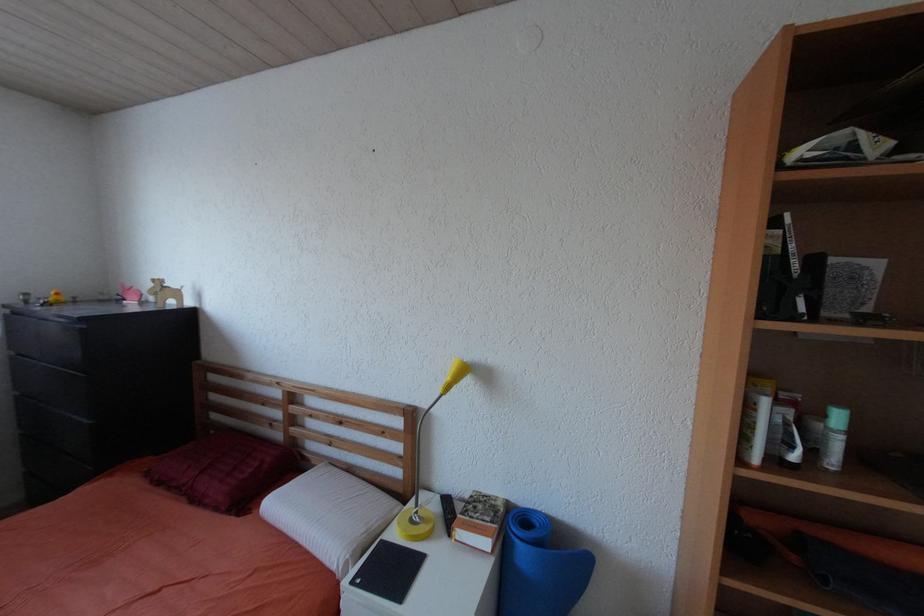
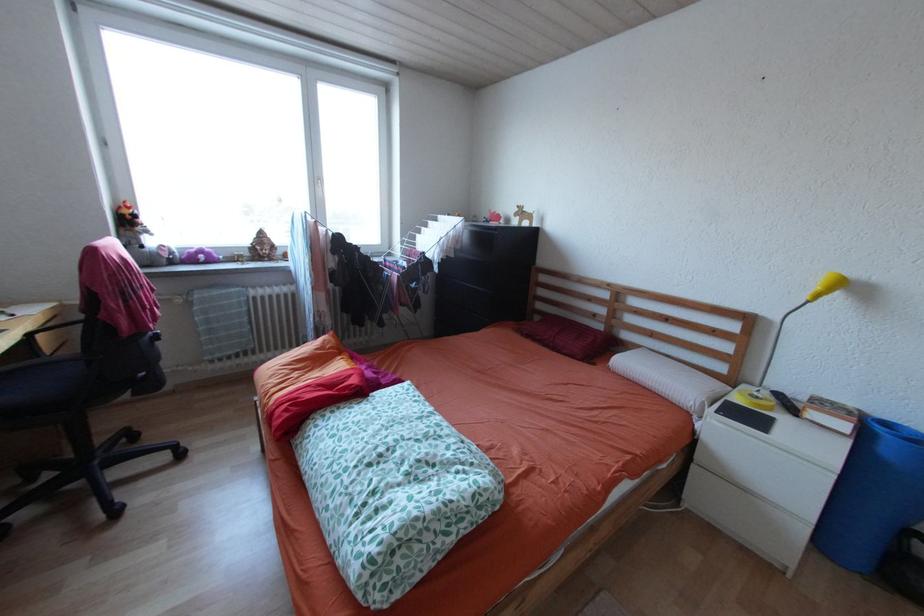
Question: The camera is either moving clockwise (left) or counter-clockwise (right) around the object. The first image is from the beginning of the video and the second image is from the end. Is the camera moving left or right when shooting the video?

Choices:
 (A) Left
 (B) Right

Answer: (B)